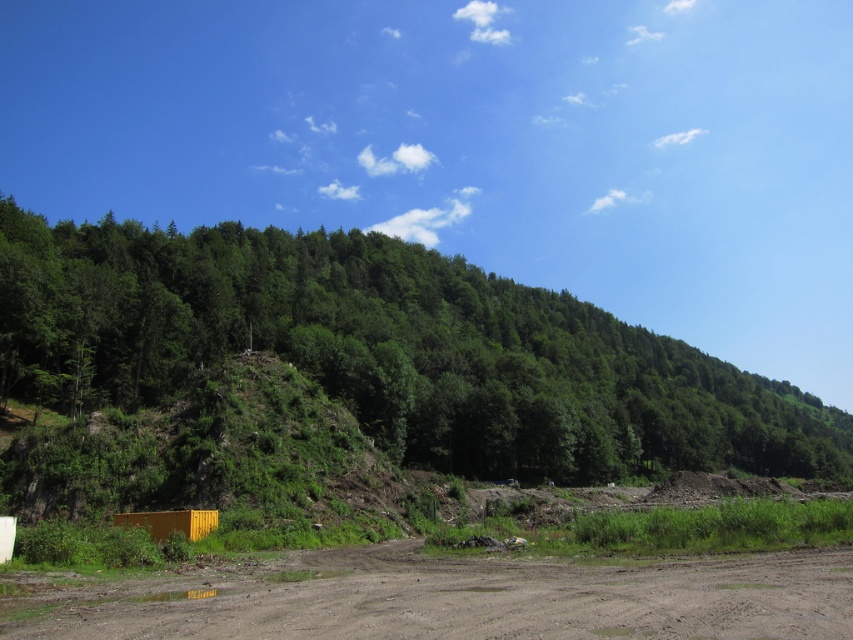
Question: Which object appears closest to the camera in this image?

Choices:
 (A) brown muddy dirt field at lower center
 (B) green leafy tree at center

Answer: (A)

Question: Does green leafy tree at center have a lesser width compared to brown muddy dirt field at lower center?

Choices:
 (A) no
 (B) yes

Answer: (A)

Question: Can you confirm if green leafy tree at center is positioned below brown muddy dirt field at lower center?

Choices:
 (A) yes
 (B) no

Answer: (A)

Question: Does green leafy tree at center have a larger size compared to brown muddy dirt field at lower center?

Choices:
 (A) no
 (B) yes

Answer: (B)

Question: Which of the following is the closest to the observer?

Choices:
 (A) green leafy tree at center
 (B) brown muddy dirt field at lower center

Answer: (B)